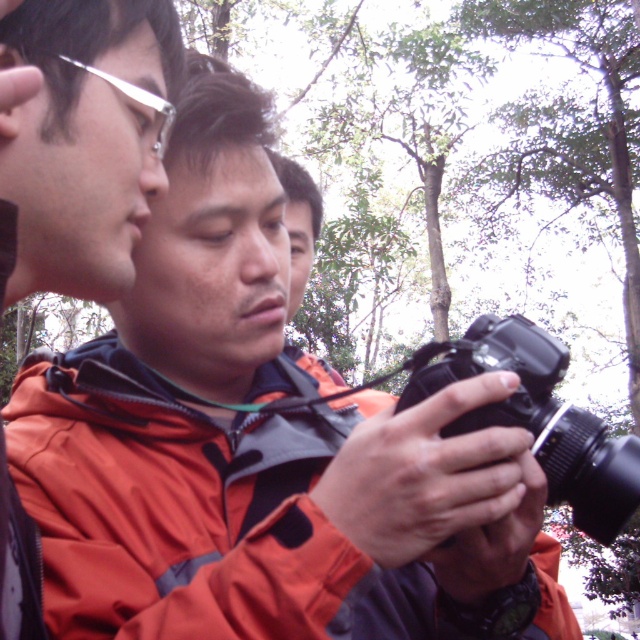
You are a photographer who needs to adjust the distance between the black plastic camera at center and the silver metallic glasses at upper left to 12 inches for a better composition. Can you move the camera or the glasses to achieve this?

The current distance between the black plastic camera at center and the silver metallic glasses at upper left is 14.81 inches. To reduce it to 12 inches, you can move either the camera closer to the glasses or the glasses closer to the camera by approximately 2.81 inches.

You are a photographer trying to frame a shot. You have two elements in your viewfinder, the orange fabric jacket at center and the silver metallic glasses at upper left. Which object should you adjust your focus to ensure both fit in the frame, considering their sizes?

The orange fabric jacket at center is wider than the silver metallic glasses at upper left, so you should adjust your focus to accommodate the wider orange fabric jacket at center to ensure both fit in the frame.

Consider the image. You are a photographer trying to adjust your camera settings. You notice two items in your viewfinder. One is the matte orange jacket at left and the other is the silver metallic glasses at upper left. Which item appears closer to you in the viewfinder?

The matte orange jacket at left appears closer to you in the viewfinder because it is positioned in front of the silver metallic glasses at upper left.